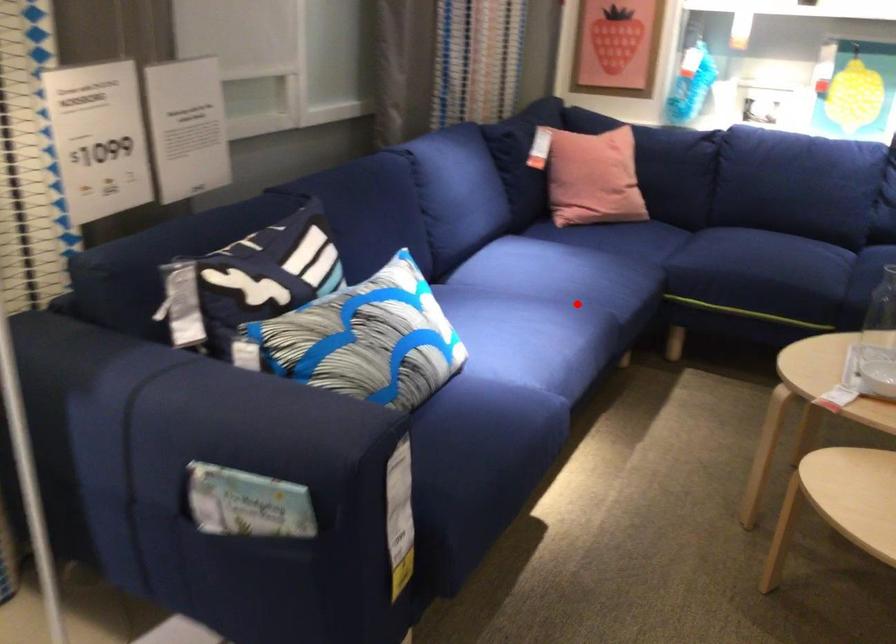
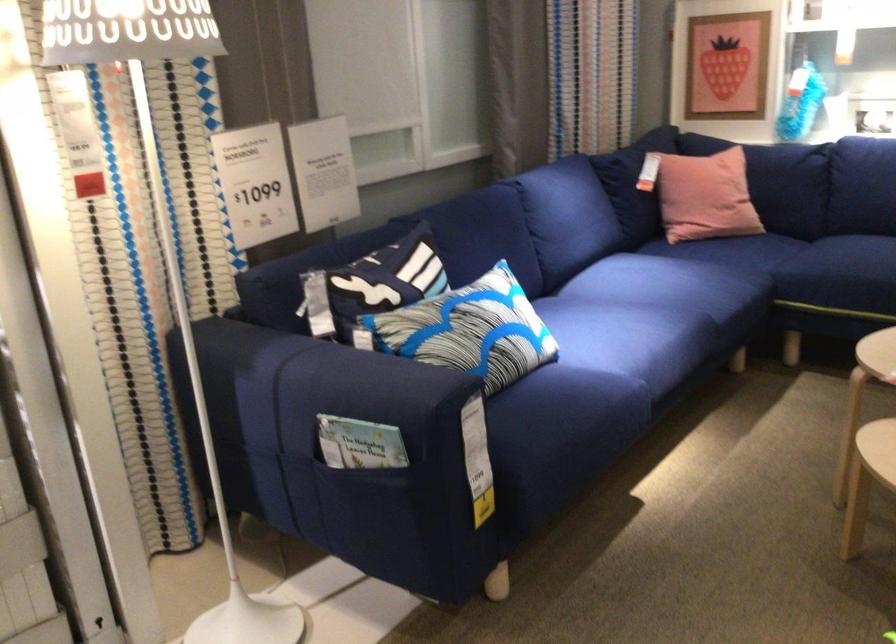
Question: I am providing you with two images of the same scene from different viewpoints. Image1 has a red point marked. In image2, the corresponding 3D location appears at what relative position? Reply with the corresponding letter.

Choices:
 (A) Closer
 (B) Farther

Answer: (B)